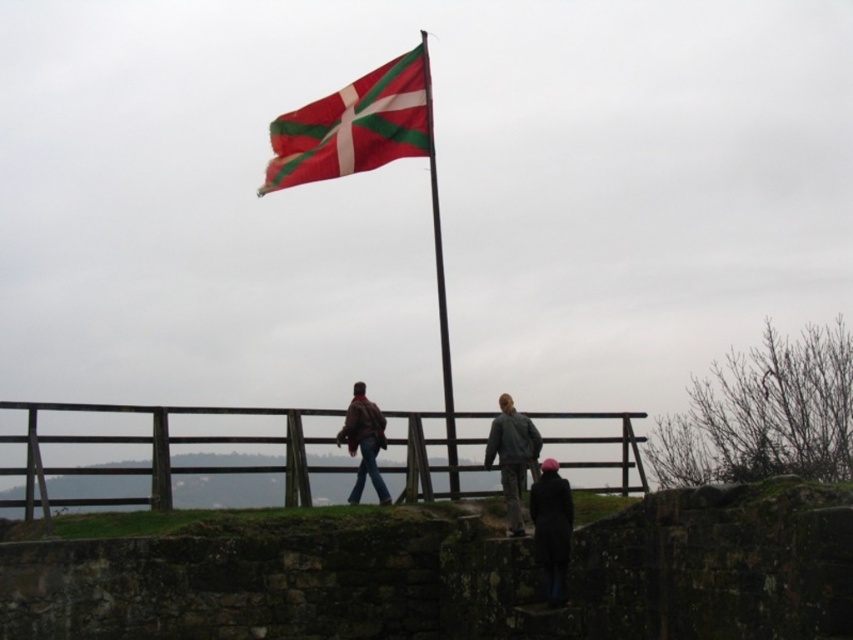
You are standing at the camera position and want to locate the dark gray jacket at lower center. According to the coordinates provided, where exactly should you look?

You should look at point 0.827 on the x axis and 0.647 on the y axis to find the dark gray jacket at lower center.

You are observing two jackets at the scene described. Which jacket is shorter in height between the dark gray jacket at center and the leather jacket at center?

The dark gray jacket at center is shorter in height compared to the leather jacket at center.